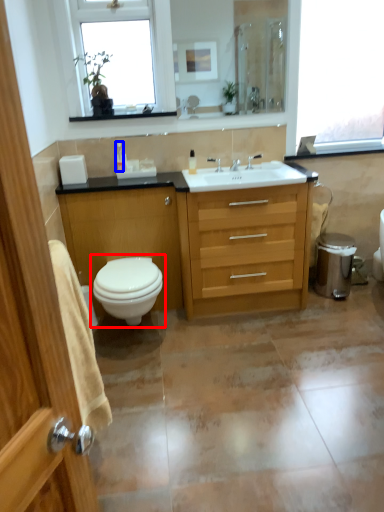
Question: Which object appears farthest to the camera in this image, toilet (highlighted by a red box) or toiletry (highlighted by a blue box)?

Choices:
 (A) toilet
 (B) toiletry

Answer: (B)